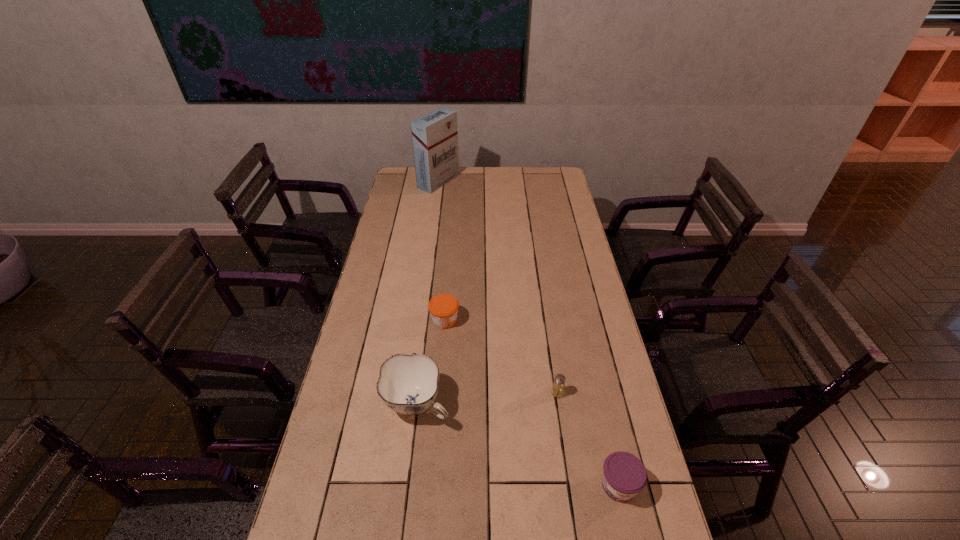
At what (x,y) coordinates should I click in order to perform the action: click on free space located on the front label of the fourth nearest object. Please return your answer as a coordinate pair (x, y). This screenshot has width=960, height=540. Looking at the image, I should click on (567, 321).

This screenshot has width=960, height=540. I want to click on free space located on the front label of the nearest object, so click(x=631, y=538).

The image size is (960, 540). Find the location of `free point located 0.230m on the front of the second object from right to left`. free point located 0.230m on the front of the second object from right to left is located at coordinates (569, 474).

What are the coordinates of `object located at the far edge` in the screenshot? It's located at (435, 135).

Identify the location of cigarette case situated at the left edge. (435, 135).

I want to click on chinaware located at the left edge, so click(408, 384).

At what (x,y) coordinates should I click in order to perform the action: click on object that is at the right edge. Please return your answer as a coordinate pair (x, y). This screenshot has width=960, height=540. Looking at the image, I should click on (624, 475).

Image resolution: width=960 pixels, height=540 pixels. Find the location of `object that is at the far left corner`. object that is at the far left corner is located at coordinates (435, 135).

In order to click on vacant space at the left edge of the desktop in this screenshot , I will do `click(413, 212)`.

At what (x,y) coordinates should I click in order to perform the action: click on blank space at the right edge. Please return your answer as a coordinate pair (x, y). This screenshot has height=540, width=960. Looking at the image, I should click on (542, 199).